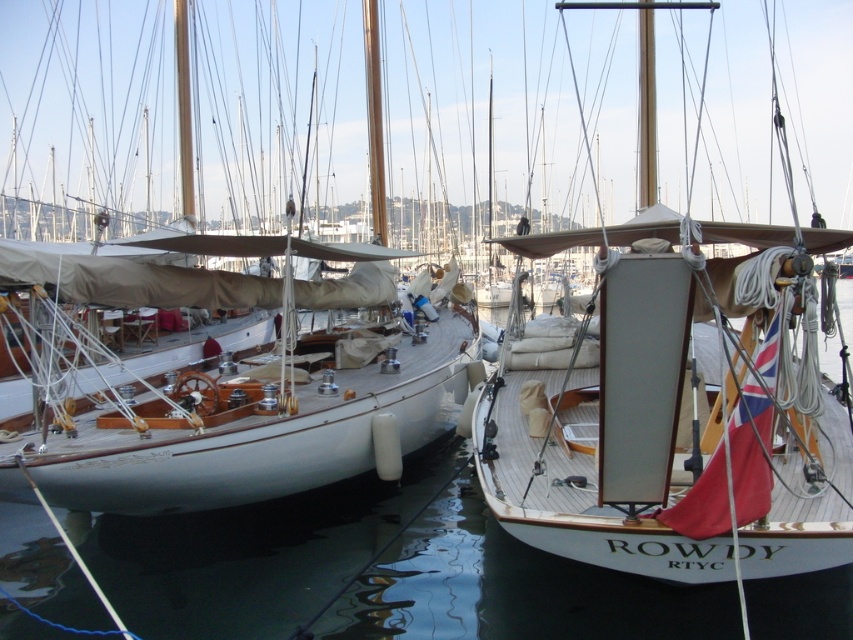
You are a photographer planning to capture the reflection of the white polished wood boat at center in the clear water at center. Based on the scene description, can you determine if the reflection will be fully visible within the frame of the water?

The clear water at center occupies less space than the white polished wood boat at center, so the reflection of the white polished wood boat at center may not be fully visible within the frame of the clear water at center since the water area is smaller than the boat.

You are a dock worker who needs to secure both the wooden sailboat at center and the white polished wood boat at center to the dock. The ropes you have can only stretch 5 meters. Can you secure both boats with the available ropes?

The wooden sailboat at center and the white polished wood boat at center are 5.35 meters apart from each other. Since the ropes can only stretch 5 meters, they are not long enough to secure both boats. You will need longer ropes or additional equipment to reach the required distance.